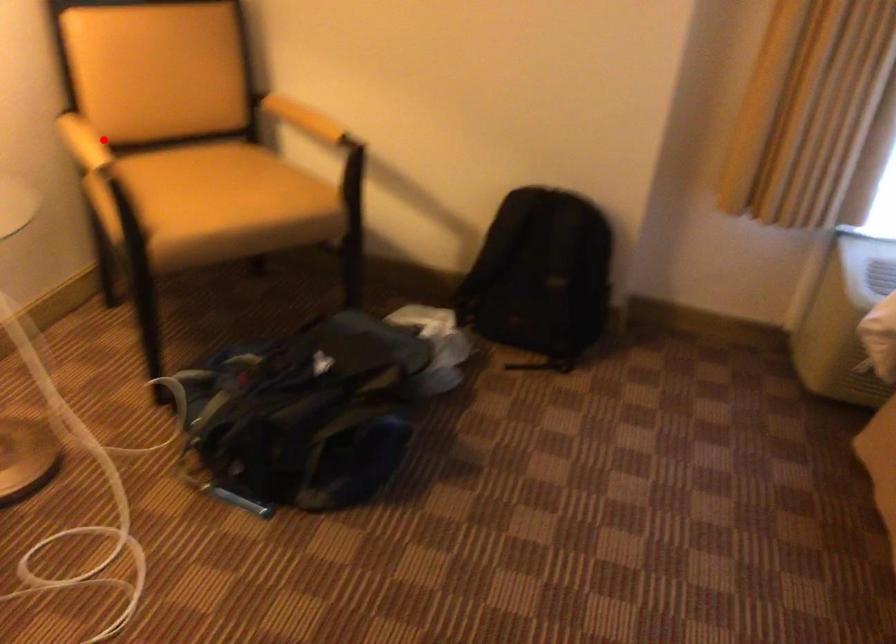
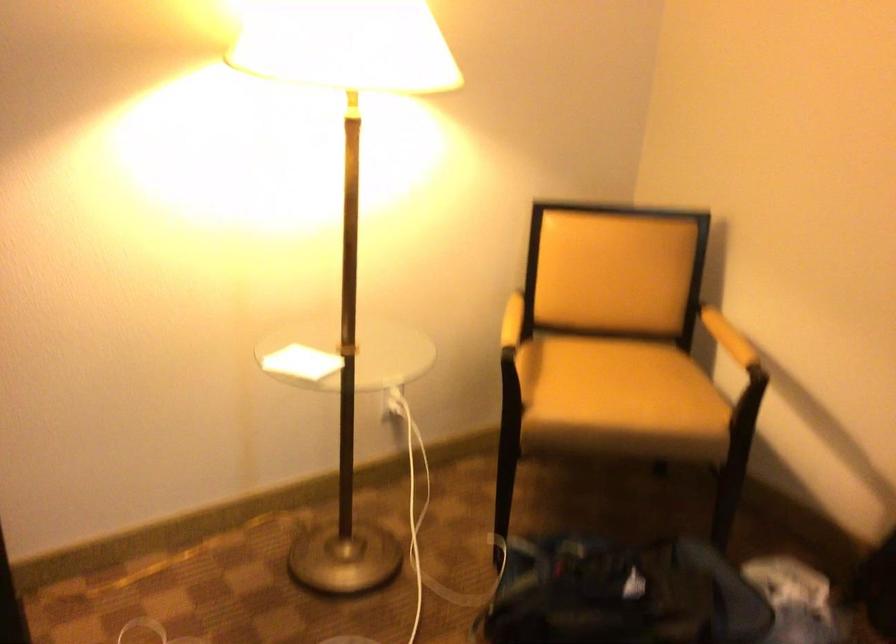
In the second image, find the point that corresponds to the highlighted location in the first image.

(512, 321)